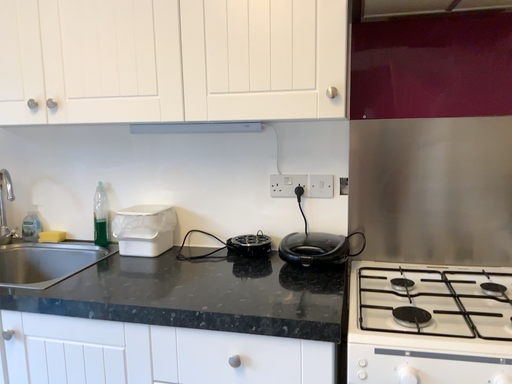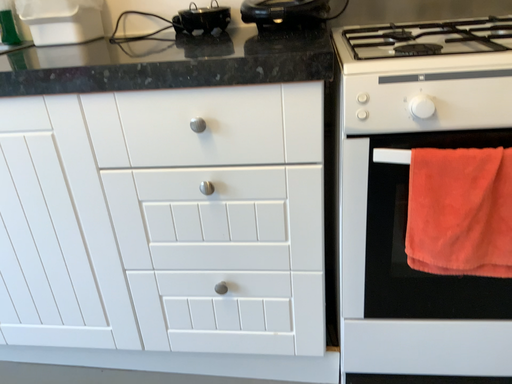
Question: How did the camera likely rotate when shooting the video?

Choices:
 (A) rotated upward
 (B) rotated downward

Answer: (B)